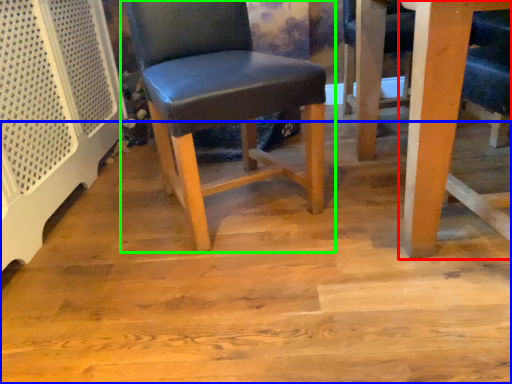
Question: Which is nearer to the table (highlighted by a red box)? plywood (highlighted by a blue box) or chair (highlighted by a green box).

Choices:
 (A) plywood
 (B) chair

Answer: (A)